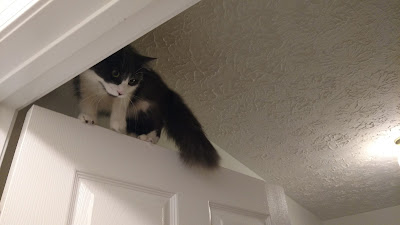
Identify the location of door. (142, 179).